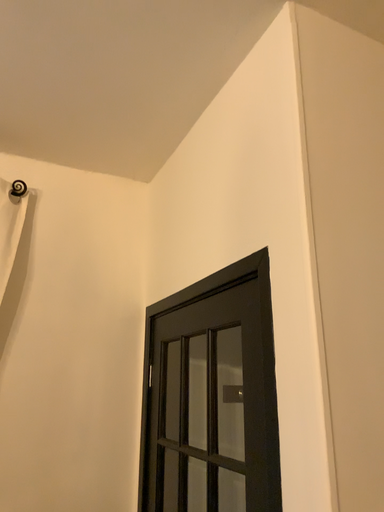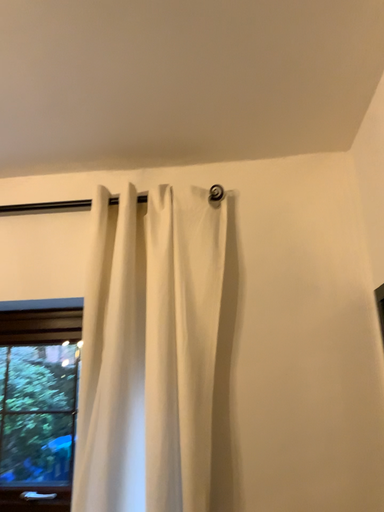
Question: How did the camera likely rotate when shooting the video?

Choices:
 (A) rotated right
 (B) rotated left

Answer: (B)